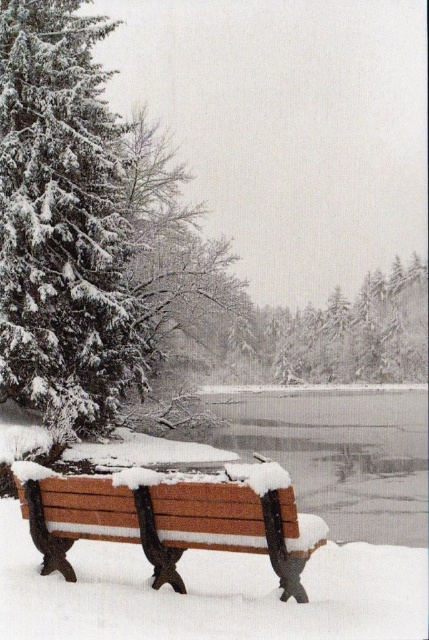
Question: Which point is farther from the camera taking this photo?

Choices:
 (A) (106, 289)
 (B) (93, 499)

Answer: (A)

Question: Where is snow-covered evergreen at left located in relation to wooden bench at lower center in the image?

Choices:
 (A) below
 (B) above

Answer: (B)

Question: Is snow-covered evergreen at left below wooden bench at lower center?

Choices:
 (A) yes
 (B) no

Answer: (B)

Question: Can you confirm if snow-covered evergreen at left is bigger than wooden bench at lower center?

Choices:
 (A) yes
 (B) no

Answer: (A)